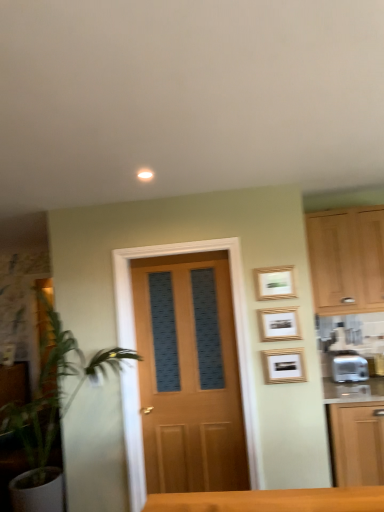
Question: Does silver metallic toaster at right contain gold-framed picture at center-right, which appears as the 3th picture frame when viewed from the top?

Choices:
 (A) yes
 (B) no

Answer: (B)

Question: Can you confirm if silver metallic toaster at right is thinner than gold-framed picture at center-right, which appears as the 3th picture frame when viewed from the top?

Choices:
 (A) yes
 (B) no

Answer: (B)

Question: Is silver metallic toaster at right next to gold-framed picture at center-right, the 1th picture frame from the bottom?

Choices:
 (A) no
 (B) yes

Answer: (A)

Question: Is silver metallic toaster at right taller than gold-framed picture at center-right, which appears as the 3th picture frame when viewed from the top?

Choices:
 (A) yes
 (B) no

Answer: (A)

Question: Would you consider silver metallic toaster at right to be distant from gold-framed picture at center-right, the 1th picture frame from the bottom?

Choices:
 (A) yes
 (B) no

Answer: (B)

Question: Can you confirm if silver metallic toaster at right is bigger than gold-framed picture at center-right, the 1th picture frame from the bottom?

Choices:
 (A) no
 (B) yes

Answer: (B)

Question: Could you tell me if gold-framed picture at upper right, which is counted as the 3th picture frame, starting from the bottom, is facing gold-framed picture at upper right, arranged as the second picture frame when ordered from the bottom?

Choices:
 (A) yes
 (B) no

Answer: (B)

Question: From a real-world perspective, is gold-framed picture at upper right, the first picture frame from the top, located higher than gold-framed picture at upper right, arranged as the second picture frame when ordered from the bottom?

Choices:
 (A) no
 (B) yes

Answer: (B)

Question: From a real-world perspective, is gold-framed picture at upper right, which is counted as the 3th picture frame, starting from the bottom, under gold-framed picture at upper right, arranged as the second picture frame when ordered from the bottom?

Choices:
 (A) no
 (B) yes

Answer: (A)

Question: Is gold-framed picture at upper right, which is counted as the 3th picture frame, starting from the bottom, taller than gold-framed picture at upper right, which ranks as the 2th picture frame in top-to-bottom order?

Choices:
 (A) yes
 (B) no

Answer: (B)

Question: Is gold-framed picture at upper right, which is counted as the 3th picture frame, starting from the bottom, next to gold-framed picture at upper right, which ranks as the 2th picture frame in top-to-bottom order?

Choices:
 (A) no
 (B) yes

Answer: (A)

Question: Is gold-framed picture at upper right, which is counted as the 3th picture frame, starting from the bottom, at the right side of gold-framed picture at upper right, arranged as the second picture frame when ordered from the bottom?

Choices:
 (A) no
 (B) yes

Answer: (A)

Question: From a real-world perspective, is gold-framed picture at upper right, which is counted as the 3th picture frame, starting from the bottom, located higher than gold-framed picture at center-right, which appears as the 3th picture frame when viewed from the top?

Choices:
 (A) yes
 (B) no

Answer: (A)